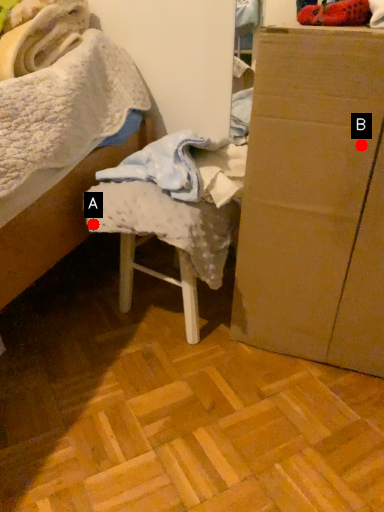
Question: Two points are circled on the image, labeled by A and B beside each circle. Which point is closer to the camera?

Choices:
 (A) A is closer
 (B) B is closer

Answer: (B)